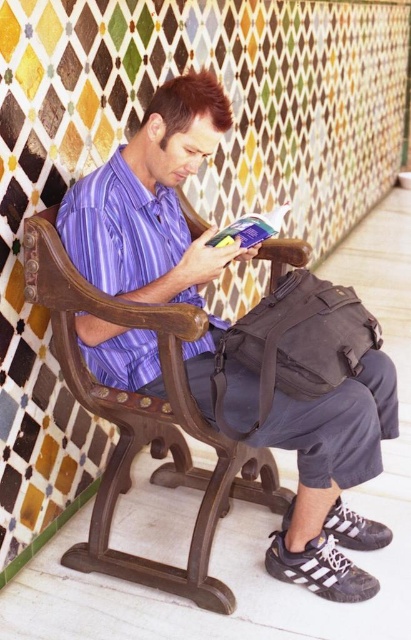
Question: Which object is positioned closest to the purple striped shirt at center?

Choices:
 (A) hardcover book at center
 (B) purple satin shirt at center

Answer: (B)

Question: Which point is farther to the camera?

Choices:
 (A) hardcover book at center
 (B) purple satin shirt at center
 (C) purple striped shirt at center

Answer: (A)

Question: Which point is closer to the camera?

Choices:
 (A) purple striped shirt at center
 (B) purple satin shirt at center

Answer: (A)

Question: Observing the image, what is the correct spatial positioning of purple striped shirt at center in reference to purple satin shirt at center?

Choices:
 (A) right
 (B) left

Answer: (A)

Question: Does purple satin shirt at center have a greater width compared to hardcover book at center?

Choices:
 (A) yes
 (B) no

Answer: (A)

Question: Is purple striped shirt at center bigger than hardcover book at center?

Choices:
 (A) yes
 (B) no

Answer: (A)